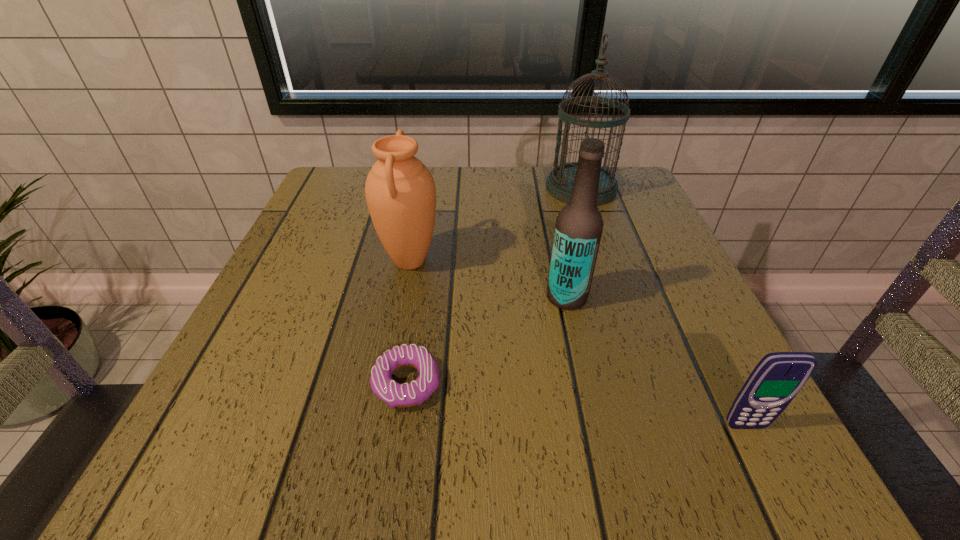
What are the coordinates of `cellular telephone that is positioned at the right edge` in the screenshot? It's located at (778, 377).

Find the location of `object at the far right corner`. object at the far right corner is located at coordinates (559, 183).

The image size is (960, 540). What are the coordinates of `object at the near right corner` in the screenshot? It's located at (778, 377).

Find the location of a particular element. Image resolution: width=960 pixels, height=540 pixels. free space at the far edge is located at coordinates (491, 201).

You are a GUI agent. You are given a task and a screenshot of the screen. Output one action in this format:
    pyautogui.click(x=<x>, y=<y>)
    Task: Click on the vacant space at the near edge
    
    Given the screenshot: What is the action you would take?
    pyautogui.click(x=555, y=451)

The image size is (960, 540). What are the coordinates of `free region at the left edge of the desktop` in the screenshot? It's located at (243, 418).

This screenshot has width=960, height=540. In order to click on blank area at the right edge in this screenshot , I will do `click(681, 371)`.

Identify the location of vacant region at the far left corner. Image resolution: width=960 pixels, height=540 pixels. (318, 206).

Image resolution: width=960 pixels, height=540 pixels. I want to click on vacant space at the near left corner of the desktop, so click(x=235, y=440).

Image resolution: width=960 pixels, height=540 pixels. Find the location of `vacant region at the far right corner of the desktop`. vacant region at the far right corner of the desktop is located at coordinates (627, 187).